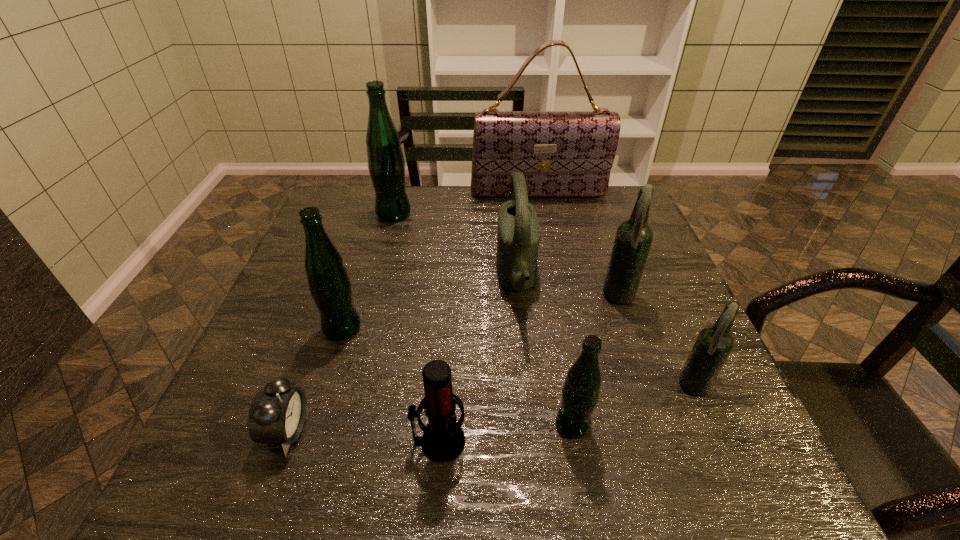
The width and height of the screenshot is (960, 540). Find the location of `brown handbag`. brown handbag is located at coordinates (561, 153).

Find the location of a particular element. The height and width of the screenshot is (540, 960). the farthest object is located at coordinates (561, 153).

I want to click on the tallest beer bottle, so pyautogui.click(x=386, y=165).

Where is `the biggest green beer bottle`? The image size is (960, 540). the biggest green beer bottle is located at coordinates (386, 165).

Locate an element on the screen. This screenshot has height=540, width=960. the second beer bottle from right to left is located at coordinates (633, 239).

This screenshot has height=540, width=960. Identify the location of the left dark beer bottle. (633, 239).

You are a GUI agent. You are given a task and a screenshot of the screen. Output one action in this format:
    pyautogui.click(x=<x>, y=<y>)
    Task: Click on the second smallest green beer bottle
    The width and height of the screenshot is (960, 540).
    Given the screenshot: What is the action you would take?
    pos(329,284)

You are a GUI agent. You are given a task and a screenshot of the screen. Output one action in this format:
    pyautogui.click(x=<x>, y=<y>)
    Task: Click on the watering can
    The image size is (960, 540).
    Given the screenshot: What is the action you would take?
    pyautogui.click(x=518, y=237)

Locate an element on the screen. the fourth farthest beer bottle is located at coordinates (714, 343).

At what (x,y) coordinates should I click in order to perform the action: click on the smaller dark beer bottle. Please return your answer as a coordinate pair (x, y). This screenshot has width=960, height=540. Looking at the image, I should click on (714, 343).